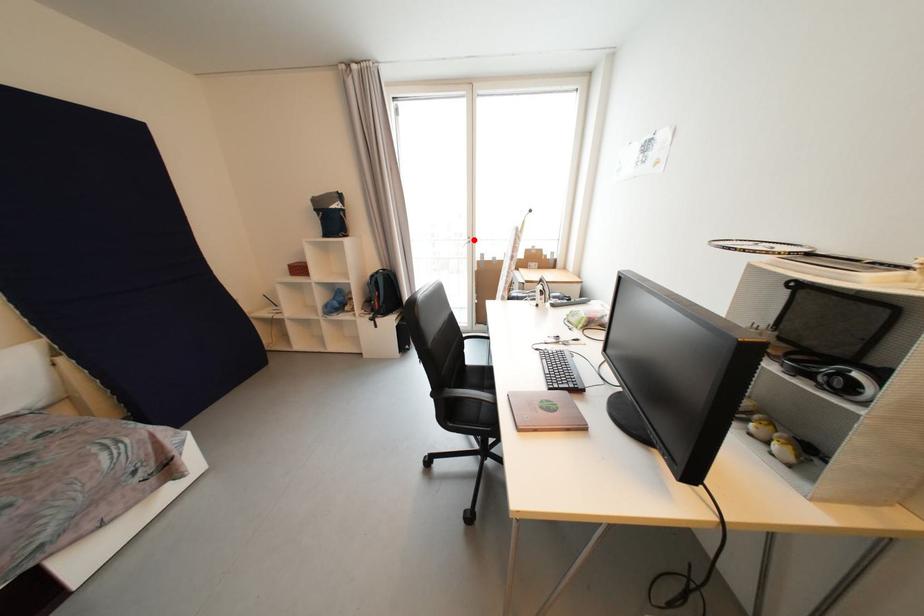
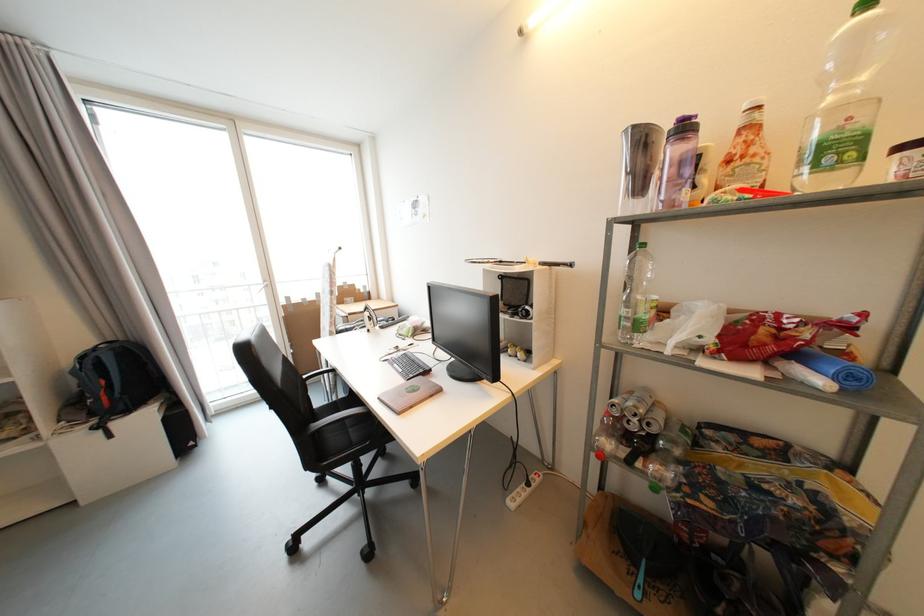
Question: I am providing you with two images of the same scene from different viewpoints. A red point is shown in image1. For the corresponding object point in image2, is it positioned nearer or farther from the camera?

Choices:
 (A) Nearer
 (B) Farther

Answer: (B)